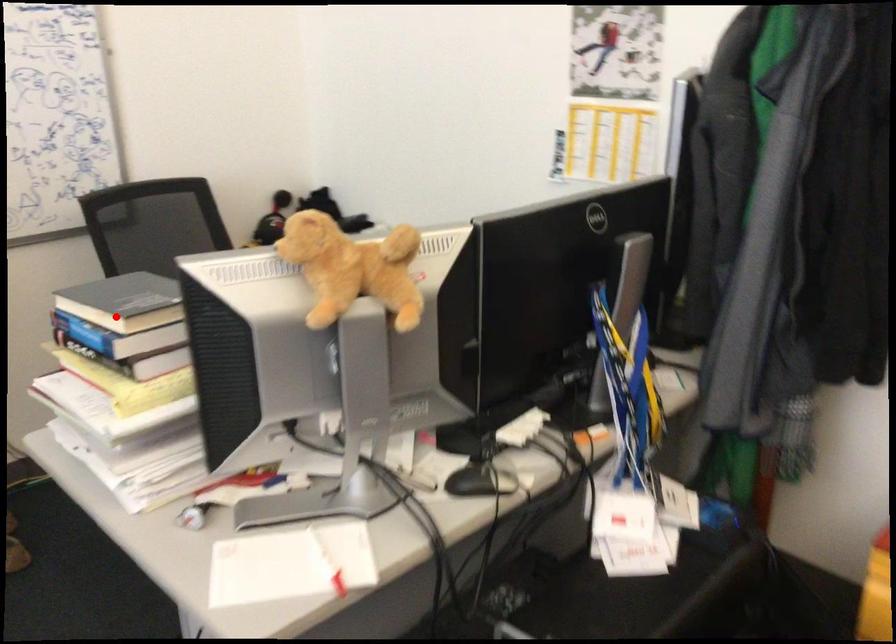
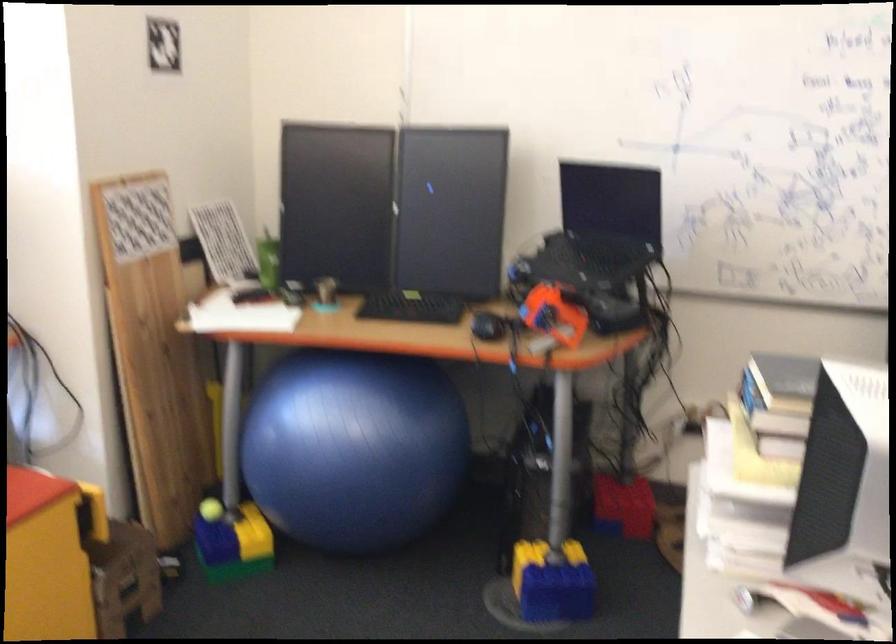
Where in the second image is the point corresponding to the highlighted location from the first image?

(778, 402)